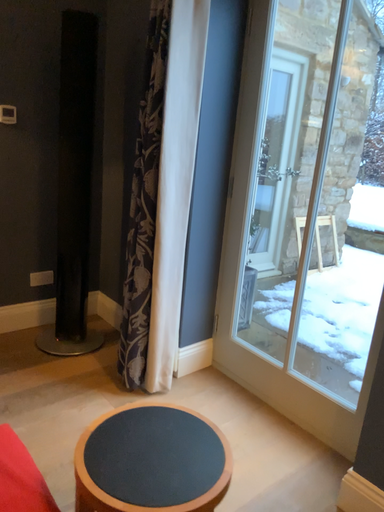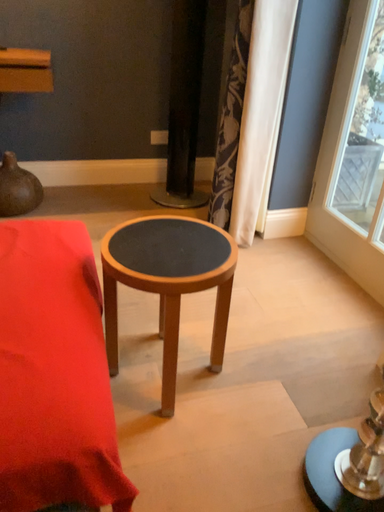
Question: Which way did the camera rotate in the video?

Choices:
 (A) rotated left
 (B) rotated right

Answer: (A)